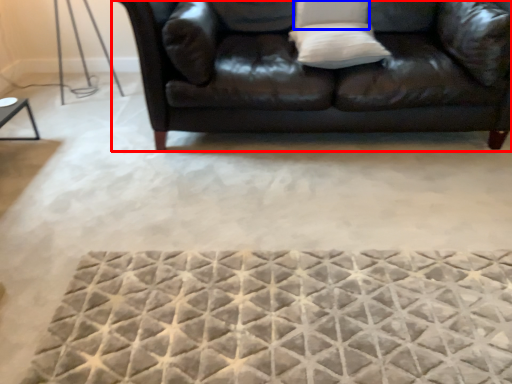
Question: Which object appears farthest to the camera in this image, studio couch (highlighted by a red box) or pillow (highlighted by a blue box)?

Choices:
 (A) studio couch
 (B) pillow

Answer: (B)